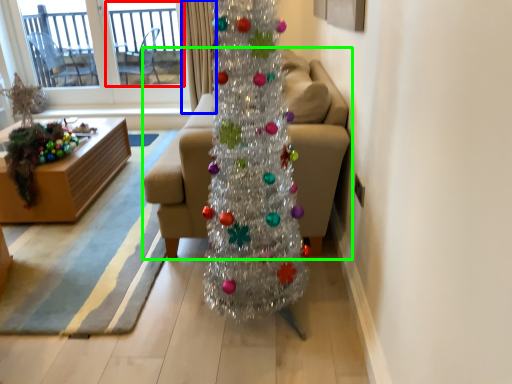
Question: Which object is positioned closest to screen door (highlighted by a red box)? Select from curtain (highlighted by a blue box) and studio couch (highlighted by a green box).

Choices:
 (A) curtain
 (B) studio couch

Answer: (A)